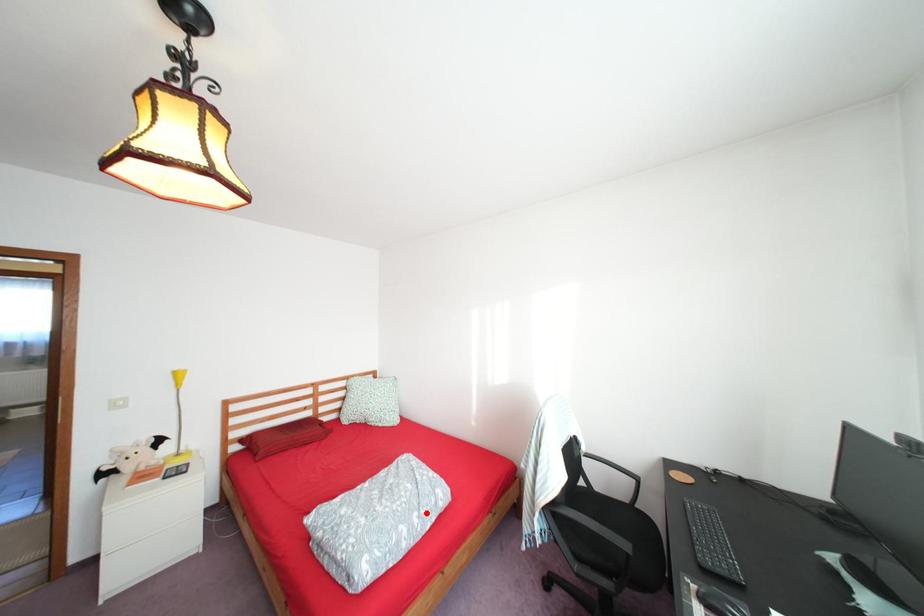
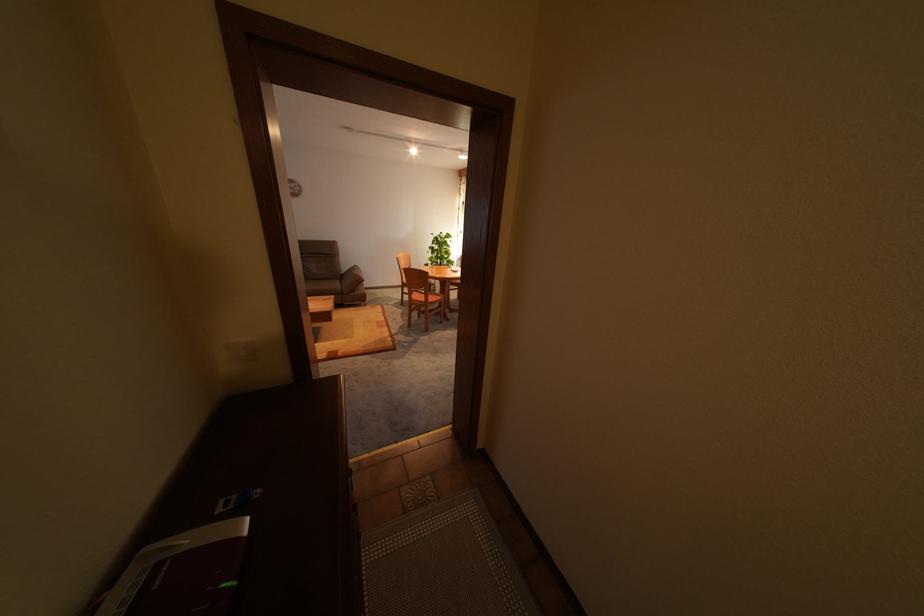
Question: I am providing you with two images of the same scene from different viewpoints. A red point is marked on the first image. At the location where the point appears in image 1, is it still visible in image 2?

Choices:
 (A) Yes
 (B) No

Answer: (B)